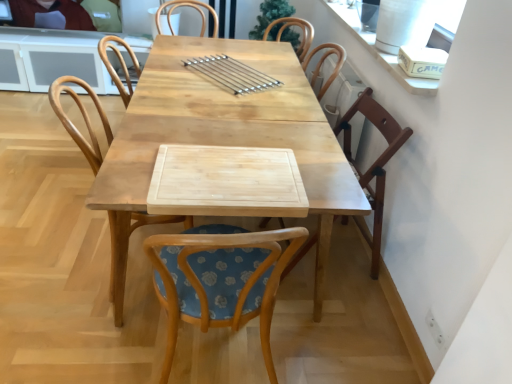
Question: From the image's perspective, is wooden chair at right, which ranks as the 1th chair in right-to-left order, over satin silver skewers at center?

Choices:
 (A) yes
 (B) no

Answer: (B)

Question: Is wooden chair at right, positioned as the third chair in left-to-right order, outside satin silver skewers at center?

Choices:
 (A) no
 (B) yes

Answer: (B)

Question: Is wooden chair at right, which ranks as the 1th chair in right-to-left order, wider than satin silver skewers at center?

Choices:
 (A) no
 (B) yes

Answer: (B)

Question: Is wooden chair at right, positioned as the third chair in left-to-right order, positioned in front of satin silver skewers at center?

Choices:
 (A) yes
 (B) no

Answer: (A)

Question: Is wooden chair at center, which is counted as the first chair, starting from the left, bigger or smaller than satin silver skewers at center?

Choices:
 (A) big
 (B) small

Answer: (A)

Question: Is wooden chair at center, which is counted as the first chair, starting from the left, wider or thinner than satin silver skewers at center?

Choices:
 (A) wide
 (B) thin

Answer: (A)

Question: From the image's perspective, relative to satin silver skewers at center, is wooden chair at center, which is the third chair from right to left, above or below?

Choices:
 (A) above
 (B) below

Answer: (B)

Question: From their relative heights in the image, would you say wooden chair at center, which is the third chair from right to left, is taller or shorter than satin silver skewers at center?

Choices:
 (A) short
 (B) tall

Answer: (B)

Question: Would you say wooden chair at right, positioned as the third chair in left-to-right order, is inside or outside natural wood table at center?

Choices:
 (A) inside
 (B) outside

Answer: (A)

Question: Is wooden chair at right, which ranks as the 1th chair in right-to-left order, to the left or to the right of natural wood table at center in the image?

Choices:
 (A) left
 (B) right

Answer: (B)

Question: From a real-world perspective, is wooden chair at right, positioned as the third chair in left-to-right order, physically located above or below natural wood table at center?

Choices:
 (A) below
 (B) above

Answer: (B)

Question: Considering the positions of wooden chair at right, positioned as the third chair in left-to-right order, and natural wood table at center in the image, is wooden chair at right, positioned as the third chair in left-to-right order, taller or shorter than natural wood table at center?

Choices:
 (A) short
 (B) tall

Answer: (B)

Question: Is wooden chair at center, which is counted as the first chair, starting from the left, inside or outside of matte black laptop at upper left?

Choices:
 (A) inside
 (B) outside

Answer: (B)

Question: In terms of width, does wooden chair at center, which is the third chair from right to left, look wider or thinner when compared to matte black laptop at upper left?

Choices:
 (A) thin
 (B) wide

Answer: (B)